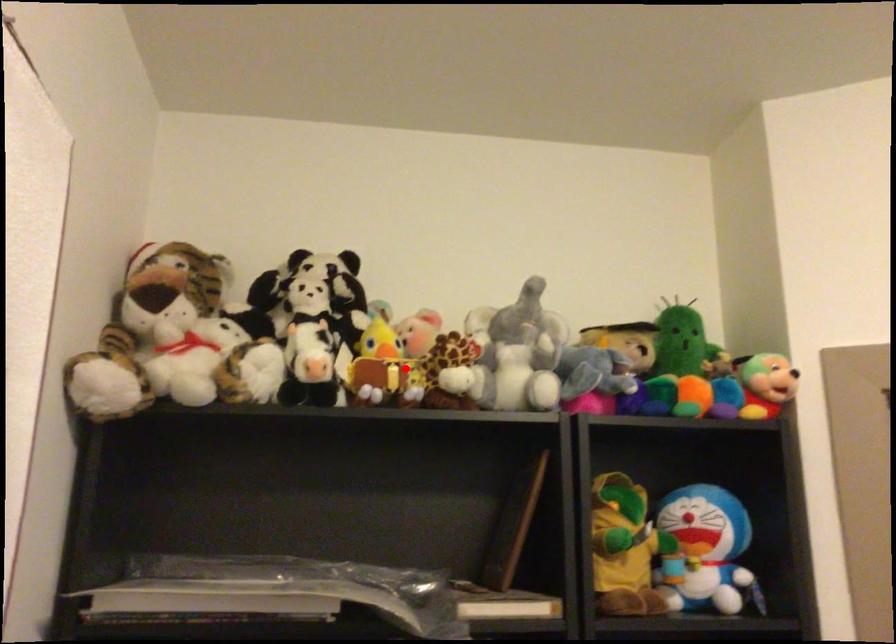
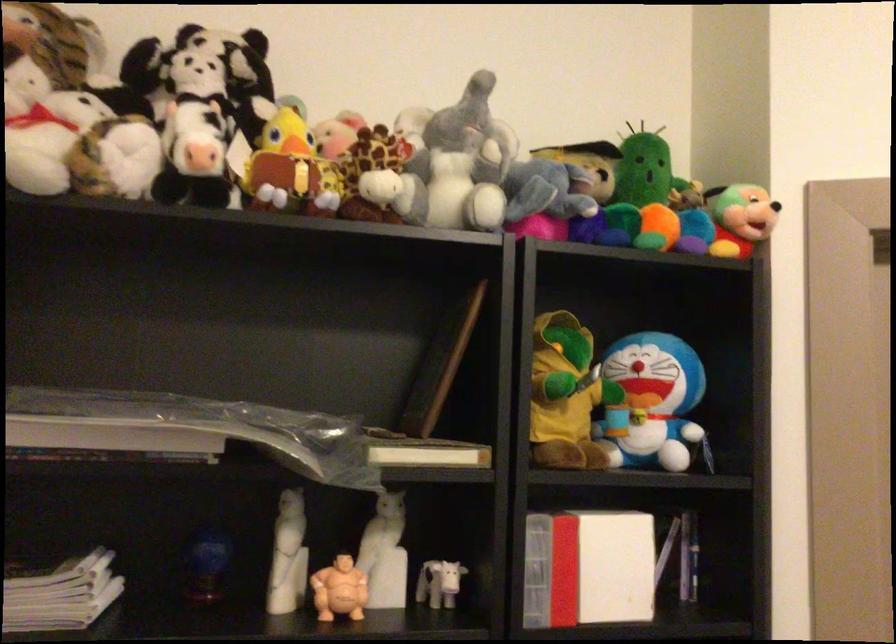
Locate, in the second image, the point that corresponds to the highlighted location in the first image.

(316, 169)